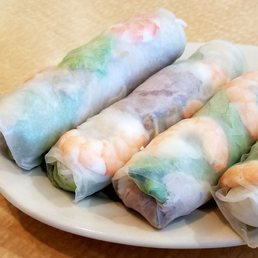
At what (x,y) coordinates should I click in order to perform the action: click on table. Please return your answer as a coordinate pair (x, y). This screenshot has width=258, height=258. Looking at the image, I should click on (27, 29).